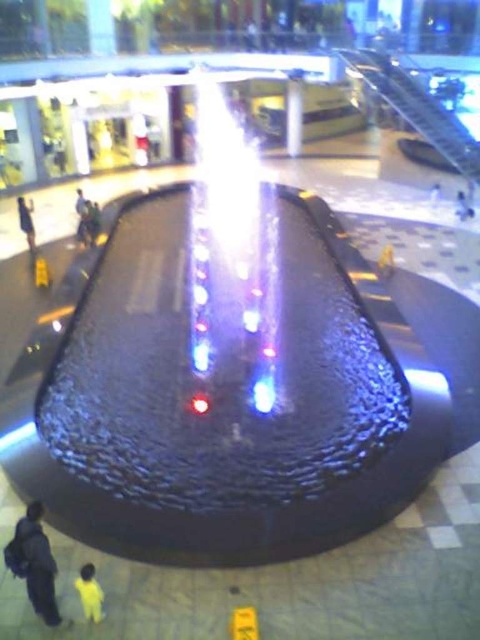
You are standing in the shopping mall and see the translucent glass water at center and the yellow fabric person at lower left. Which object is taller?

The translucent glass water at center is taller than the yellow fabric person at lower left.